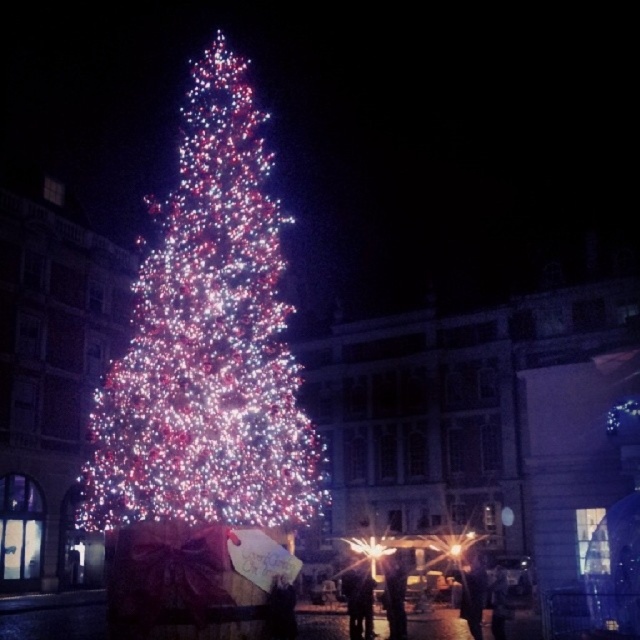
You are standing in front of the Christmas tree and notice two items of clothing near the gift box. The dark fabric coat at lower center and the denim pants at center. Which item is closer to you?

The dark fabric coat at lower center is closer to the viewer than the denim pants at center.

You are standing in front of the Christmas tree and notice two items of clothing. The dark fabric coat at lower center and the denim pants at center. Which clothing item is higher up?

The dark fabric coat at lower center is taller than denim pants at center, so the dark fabric coat at lower center is higher up.